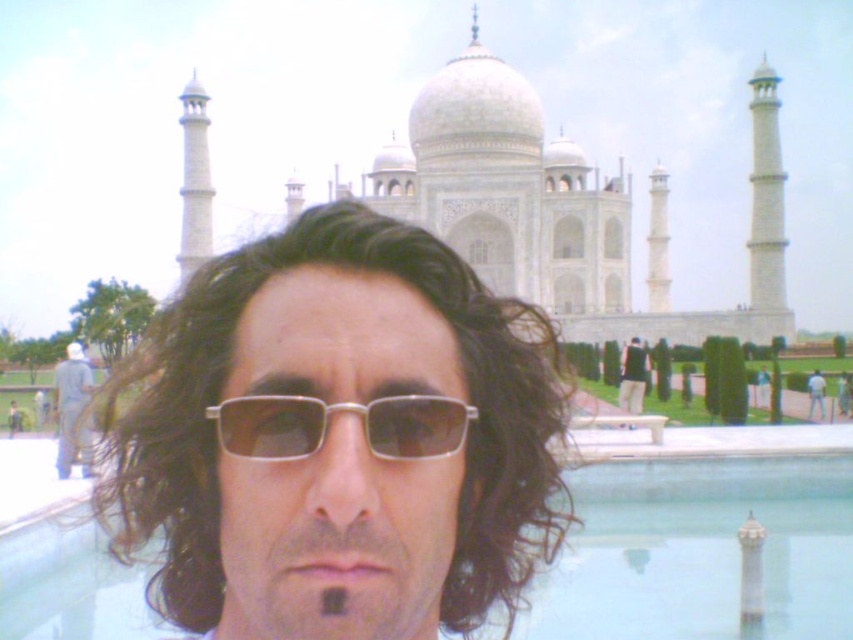
Can you confirm if silver metallic glasses at center is positioned to the right of black fabric shirt at center?

No, silver metallic glasses at center is not to the right of black fabric shirt at center.

Who is more forward, [303,433] or [643,368]?

Point [303,433] is more forward.

Image resolution: width=853 pixels, height=640 pixels. What are the coordinates of `silver metallic glasses at center` in the screenshot? It's located at (328, 426).

Is point (144, 524) closer to viewer compared to point (630, 403)?

Yes, it is in front of point (630, 403).

Does dark curly hair at center appear on the left side of black fabric shirt at center?

Correct, you'll find dark curly hair at center to the left of black fabric shirt at center.

Locate an element on the screen. The width and height of the screenshot is (853, 640). dark curly hair at center is located at coordinates (337, 440).

Is light blue denim jeans at left below white matte baseball uniform at center?

No, light blue denim jeans at left is not below white matte baseball uniform at center.

Who is lower down, light blue denim jeans at left or white matte baseball uniform at center?

white matte baseball uniform at center is below.

Between point (91, 456) and point (809, 419), which one is positioned behind?

Point (809, 419)

At what (x,y) coordinates should I click in order to perform the action: click on light blue denim jeans at left. Please return your answer as a coordinate pair (x, y). Looking at the image, I should click on (73, 412).